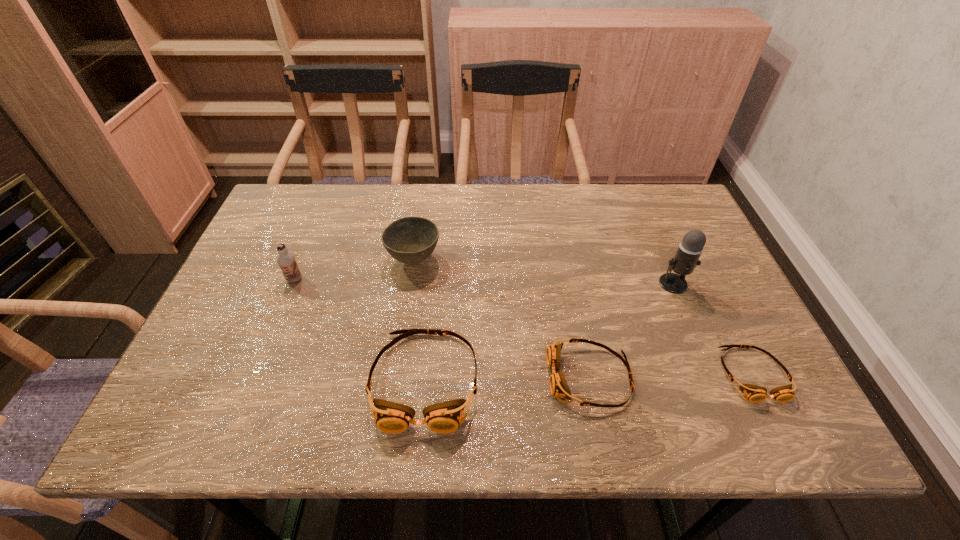
This screenshot has width=960, height=540. I want to click on free point located 0.370m with the lenses facing forward on the fourth object from left to right, so click(x=373, y=377).

You are a GUI agent. You are given a task and a screenshot of the screen. Output one action in this format:
    pyautogui.click(x=<x>, y=<y>)
    Task: Click on the vacant region located with the lenses facing forward on the fourth object from left to right
    Image resolution: width=960 pixels, height=540 pixels.
    Given the screenshot: What is the action you would take?
    pyautogui.click(x=472, y=377)

You are a GUI agent. You are given a task and a screenshot of the screen. Output one action in this format:
    pyautogui.click(x=<x>, y=<y>)
    Task: Click on the free spot located with the lenses facing forward on the fourth object from left to right
    
    Given the screenshot: What is the action you would take?
    pyautogui.click(x=506, y=377)

I want to click on vacant space situated 0.090m on the back of the microphone, so click(660, 250).

The width and height of the screenshot is (960, 540). What are the coordinates of `vacant area located 0.290m on the front of the bowl` in the screenshot? It's located at [396, 380].

The height and width of the screenshot is (540, 960). In order to click on free region located 0.190m on the right of the leftmost object in this screenshot , I will do `click(376, 279)`.

Identify the location of object at the left edge. (286, 260).

Where is `goggles located in the right edge section of the desktop`? The width and height of the screenshot is (960, 540). goggles located in the right edge section of the desktop is located at coordinates (754, 393).

What are the coordinates of `microphone positioned at the right edge` in the screenshot? It's located at (689, 251).

You are a GUI agent. You are given a task and a screenshot of the screen. Output one action in this format:
    pyautogui.click(x=<x>, y=<y>)
    Task: Click on the object present at the near right corner
    The width and height of the screenshot is (960, 540).
    Given the screenshot: What is the action you would take?
    pyautogui.click(x=754, y=393)